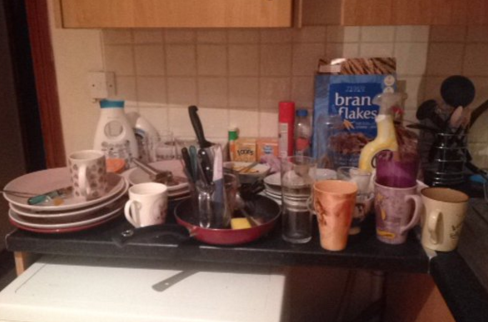
This screenshot has width=488, height=322. I want to click on cabinet, so click(176, 13), click(415, 5).